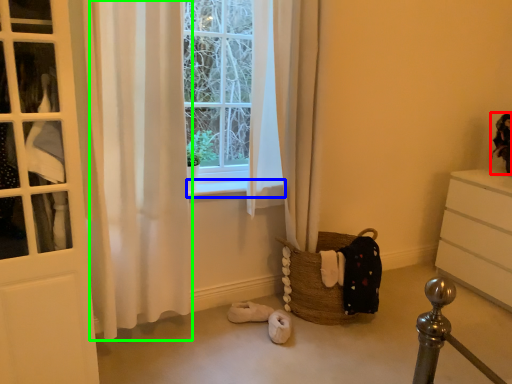
Question: Considering the real-world distances, which object is farthest from doll (highlighted by a red box)? window sill (highlighted by a blue box) or curtain (highlighted by a green box)?

Choices:
 (A) window sill
 (B) curtain

Answer: (B)